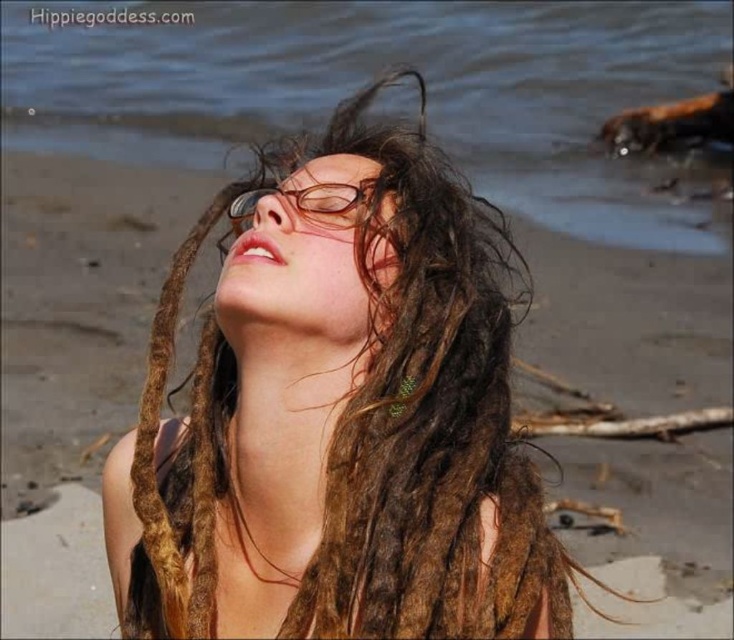
Based on the scene description, can you determine which object is shorter between the brown dreadlocks at center and the clear blue water at upper center?

The brown dreadlocks at center has a lesser height compared to the clear blue water at upper center, so the brown dreadlocks at center is shorter.

You are a photographer trying to capture the reflection of the clear blue water at upper center in the brown plastic glasses at center. Is the glasses tall enough to fully reflect the water?

The clear blue water at upper center has a greater height compared to brown plastic glasses at center, so the glasses are not tall enough to fully reflect the water.

You are a photographer trying to capture the clear blue water at upper center and the brown plastic glasses at center. Which object is closer to the camera?

The clear blue water at upper center is closer to the camera because the brown plastic glasses at center is behind it.